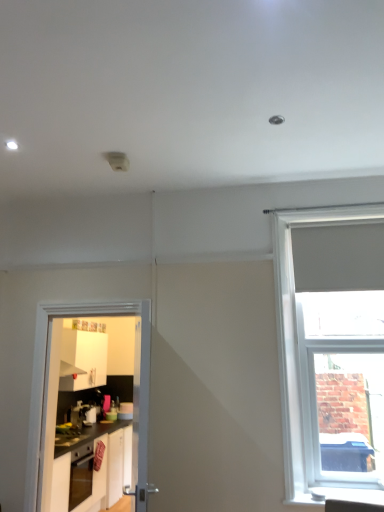
Question: From a real-world perspective, is white glossy cabinets at lower left beneath white smooth window sill at lower right?

Choices:
 (A) no
 (B) yes

Answer: (B)

Question: Does white glossy cabinets at lower left have a lesser width compared to white smooth window sill at lower right?

Choices:
 (A) no
 (B) yes

Answer: (A)

Question: Is white glossy cabinets at lower left far away from white smooth window sill at lower right?

Choices:
 (A) no
 (B) yes

Answer: (B)

Question: Can we say white glossy cabinets at lower left lies outside white smooth window sill at lower right?

Choices:
 (A) yes
 (B) no

Answer: (A)

Question: Does white glossy cabinets at lower left have a smaller size compared to white smooth window sill at lower right?

Choices:
 (A) yes
 (B) no

Answer: (B)

Question: From the image's perspective, relative to white matte window at right, is satin silver coffee machine at left above or below?

Choices:
 (A) below
 (B) above

Answer: (A)

Question: Do you think satin silver coffee machine at left is within white matte window at right, or outside of it?

Choices:
 (A) outside
 (B) inside

Answer: (A)

Question: Is satin silver coffee machine at left wider or thinner than white matte window at right?

Choices:
 (A) thin
 (B) wide

Answer: (B)

Question: In terms of size, does satin silver coffee machine at left appear bigger or smaller than white matte window at right?

Choices:
 (A) big
 (B) small

Answer: (B)

Question: Considering the positions of white matte window at right and satin silver coffee machine at left in the image, is white matte window at right taller or shorter than satin silver coffee machine at left?

Choices:
 (A) tall
 (B) short

Answer: (A)

Question: From a real-world perspective, is white matte window at right above or below satin silver coffee machine at left?

Choices:
 (A) above
 (B) below

Answer: (A)

Question: From the image's perspective, is white matte window at right above or below satin silver coffee machine at left?

Choices:
 (A) below
 (B) above

Answer: (B)

Question: Considering the positions of point (286, 485) and point (94, 408), is point (286, 485) closer or farther from the camera than point (94, 408)?

Choices:
 (A) farther
 (B) closer

Answer: (B)

Question: Relative to white smooth window sill at lower right, is white glossy cabinets at lower left in front or behind?

Choices:
 (A) front
 (B) behind

Answer: (B)

Question: Is white glossy cabinets at lower left inside the boundaries of white smooth window sill at lower right, or outside?

Choices:
 (A) inside
 (B) outside

Answer: (B)